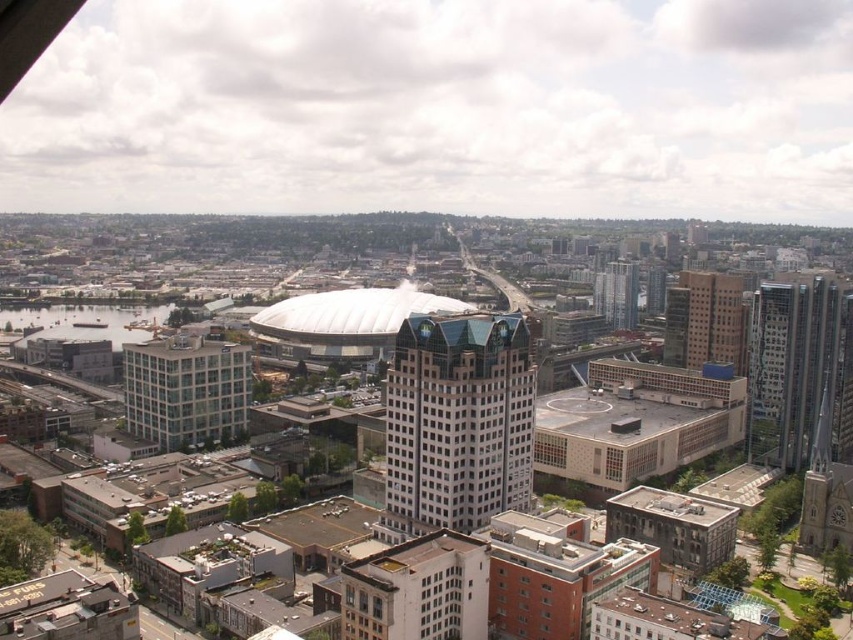
Does glassy steel skyscraper at right lie behind glassy skyscraper at center-right?

No, glassy steel skyscraper at right is in front of glassy skyscraper at center-right.

Is glassy steel skyscraper at right below glassy skyscraper at center-right?

Indeed, glassy steel skyscraper at right is positioned under glassy skyscraper at center-right.

Identify the location of glassy steel skyscraper at right. (799, 369).

You are a GUI agent. You are given a task and a screenshot of the screen. Output one action in this format:
    pyautogui.click(x=<x>, y=<y>)
    Task: Click on the glassy steel skyscraper at right
    This screenshot has width=853, height=640.
    Given the screenshot: What is the action you would take?
    pyautogui.click(x=799, y=369)

Can you confirm if beige concrete building at center is positioned to the left of glassy steel skyscraper at center-right?

No, beige concrete building at center is not to the left of glassy steel skyscraper at center-right.

Which is behind, point (685, 289) or point (622, 294)?

The point (622, 294) is behind.

At what (x,y) coordinates should I click in order to perform the action: click on beige concrete building at center. Please return your answer as a coordinate pair (x, y). The image size is (853, 640). Looking at the image, I should click on (704, 321).

Is clear glass building at center thinner than beige concrete building at center?

In fact, clear glass building at center might be wider than beige concrete building at center.

Can you confirm if clear glass building at center is taller than beige concrete building at center?

No.

Locate an element on the screen. The width and height of the screenshot is (853, 640). clear glass building at center is located at coordinates (186, 390).